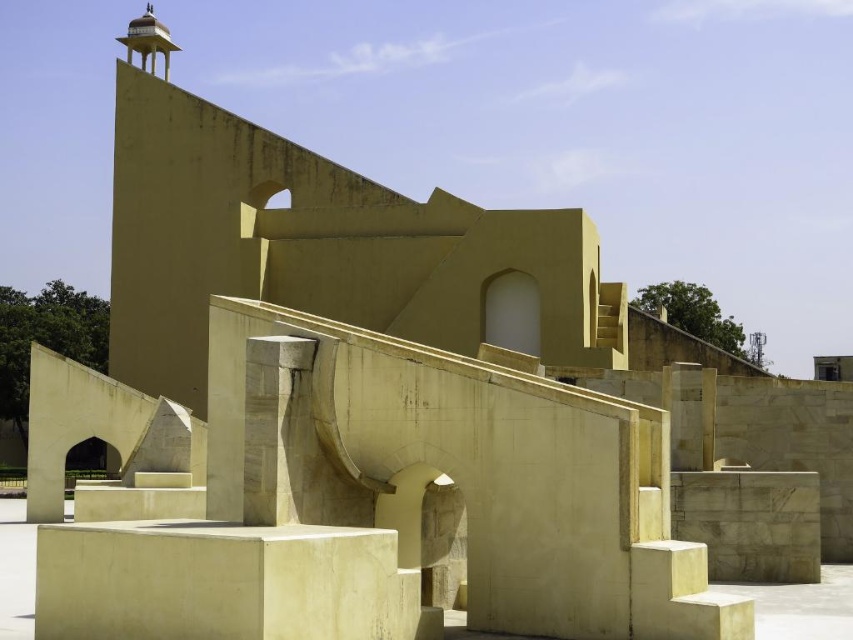
Question: Does gray concrete wall at center appear under beige stone stairs at lower right?

Choices:
 (A) no
 (B) yes

Answer: (B)

Question: Is beige stone cube at center to the right of gray concrete wall at center from the viewer's perspective?

Choices:
 (A) yes
 (B) no

Answer: (B)

Question: Which of these objects is positioned farthest from the white marble pillar at center?

Choices:
 (A) beige stone stairs at lower right
 (B) gray concrete wall at center

Answer: (B)

Question: Which of these objects is positioned closest to the gray concrete wall at center?

Choices:
 (A) white marble pillar at center
 (B) beige stone stairs at lower right

Answer: (B)

Question: Estimate the real-world distances between objects in this image. Which object is closer to the gray concrete wall at center?

Choices:
 (A) beige stone stairs at lower right
 (B) white marble pillar at center
 (C) beige stone cube at center

Answer: (A)

Question: Does gray concrete wall at center appear under beige stone stairs at lower right?

Choices:
 (A) yes
 (B) no

Answer: (A)